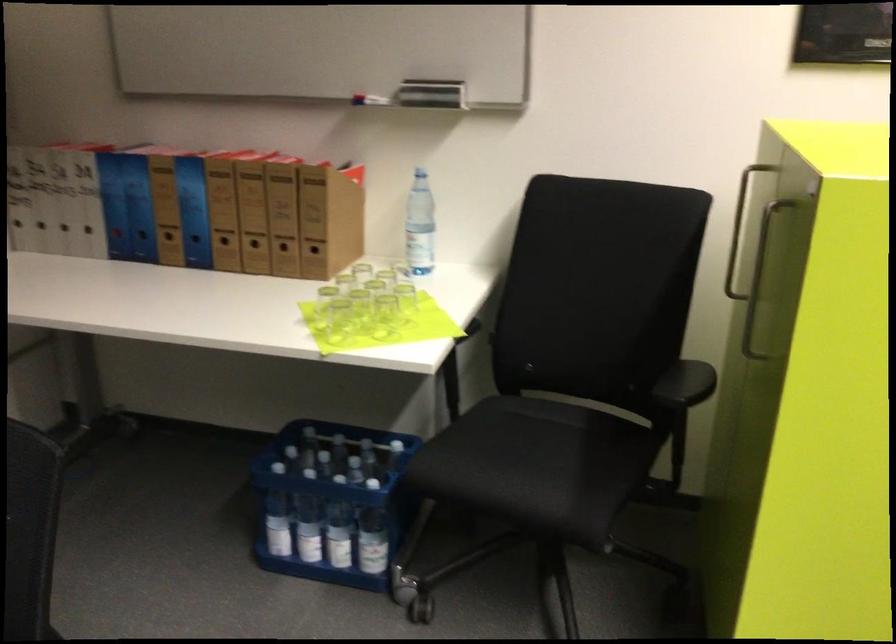
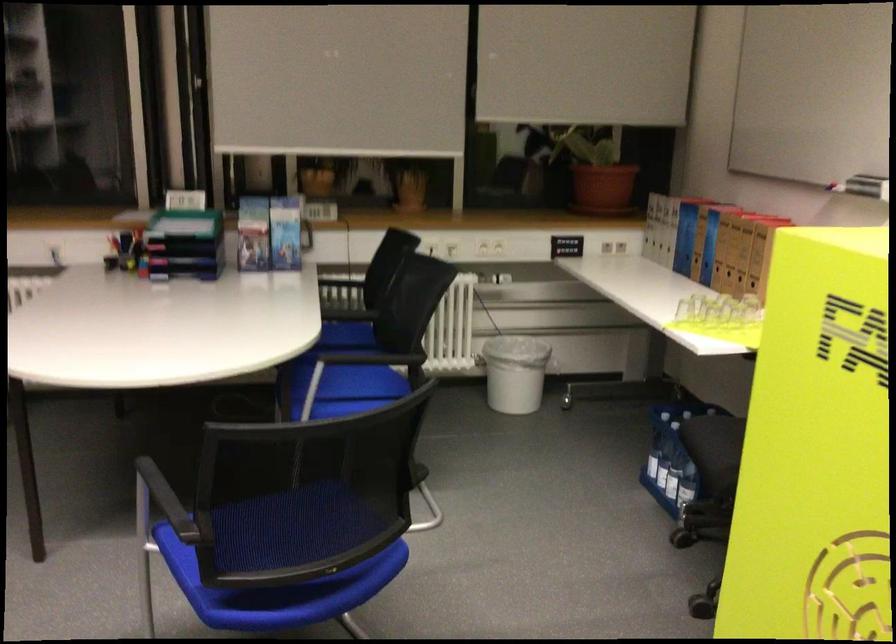
Question: I am providing you with two images of the same scene from different viewpoints. Which of the following objects are not visible in image2?

Choices:
 (A) brown ring binder
 (B) small drinking glass
 (C) small glass cup
 (D) small soap bar

Answer: (B)